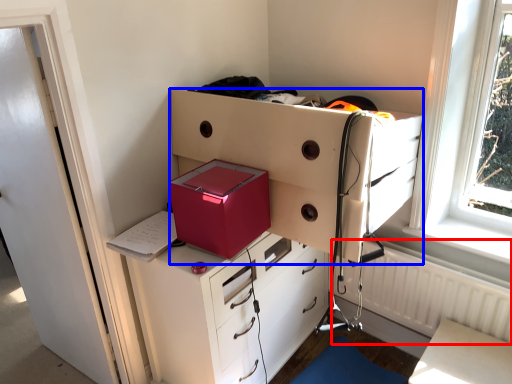
Question: Among these objects, which one is farthest to the camera, radiator (highlighted by a red box) or chest of drawers (highlighted by a blue box)?

Choices:
 (A) radiator
 (B) chest of drawers

Answer: (A)